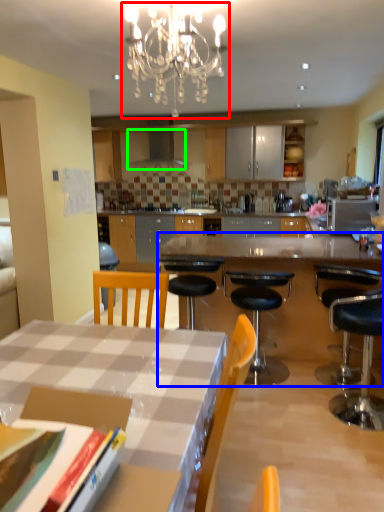
Question: Which object is the farthest from light fixture (highlighted by a red box)? Choose among these: table (highlighted by a blue box) or exhaust hood (highlighted by a green box).

Choices:
 (A) table
 (B) exhaust hood

Answer: (B)